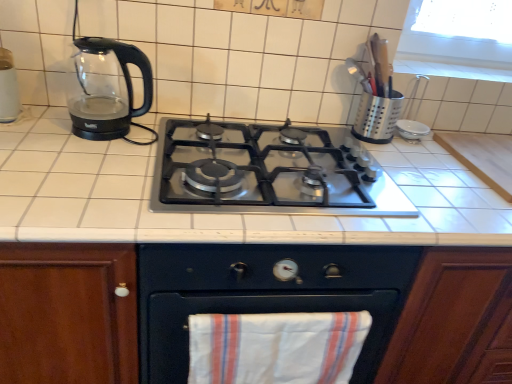
Question: Does transparent glass kettle at left have a greater height compared to white tile countertop at center?

Choices:
 (A) yes
 (B) no

Answer: (B)

Question: Is transparent glass kettle at left next to white tile countertop at center and touching it?

Choices:
 (A) no
 (B) yes

Answer: (A)

Question: Does transparent glass kettle at left have a greater width compared to white tile countertop at center?

Choices:
 (A) no
 (B) yes

Answer: (A)

Question: Is transparent glass kettle at left aimed at white tile countertop at center?

Choices:
 (A) yes
 (B) no

Answer: (B)

Question: Is transparent glass kettle at left smaller than white tile countertop at center?

Choices:
 (A) yes
 (B) no

Answer: (A)

Question: Considering the relative positions of transparent glass kettle at left and white tile countertop at center in the image provided, is transparent glass kettle at left to the left of white tile countertop at center from the viewer's perspective?

Choices:
 (A) yes
 (B) no

Answer: (A)

Question: Can you confirm if silver metallic utensil holder at upper right is shorter than white cotton beach towel at lower center?

Choices:
 (A) no
 (B) yes

Answer: (B)

Question: Is silver metallic utensil holder at upper right far away from white cotton beach towel at lower center?

Choices:
 (A) yes
 (B) no

Answer: (B)

Question: Would you say silver metallic utensil holder at upper right is outside white cotton beach towel at lower center?

Choices:
 (A) yes
 (B) no

Answer: (A)

Question: From the image's perspective, is silver metallic utensil holder at upper right located beneath white cotton beach towel at lower center?

Choices:
 (A) no
 (B) yes

Answer: (A)

Question: Is white cotton beach towel at lower center inside silver metallic utensil holder at upper right?

Choices:
 (A) yes
 (B) no

Answer: (B)

Question: Can you confirm if silver metallic utensil holder at upper right is bigger than white cotton beach towel at lower center?

Choices:
 (A) no
 (B) yes

Answer: (A)

Question: Considering the relative sizes of wooden cabinet at center and transparent glass kettle at left in the image provided, is wooden cabinet at center shorter than transparent glass kettle at left?

Choices:
 (A) yes
 (B) no

Answer: (B)